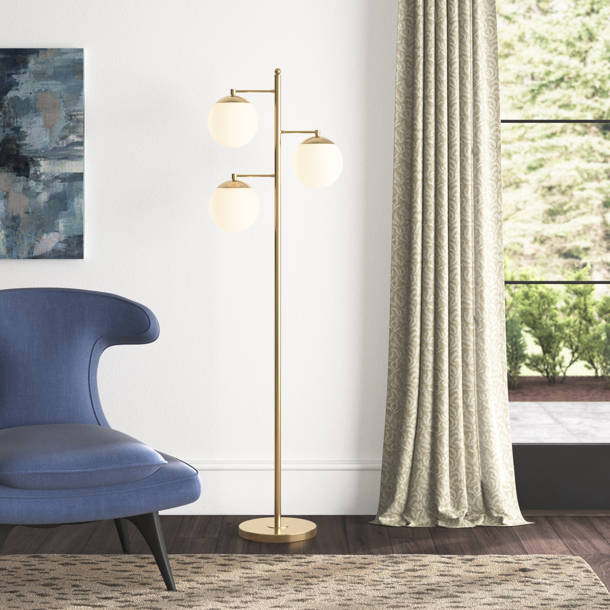
Identify the location of brown wood floor. The width and height of the screenshot is (610, 610). (547, 540).